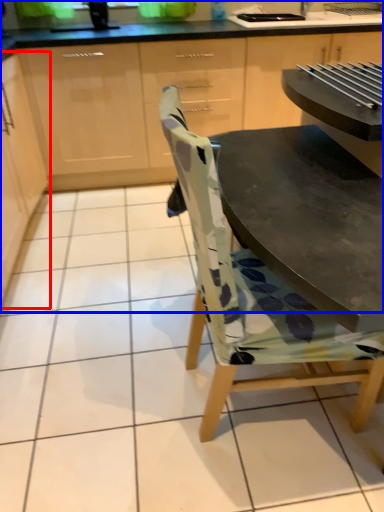
Question: Which object appears farthest to the camera in this image, cabinetry (highlighted by a red box) or cabinetry (highlighted by a blue box)?

Choices:
 (A) cabinetry
 (B) cabinetry

Answer: (B)